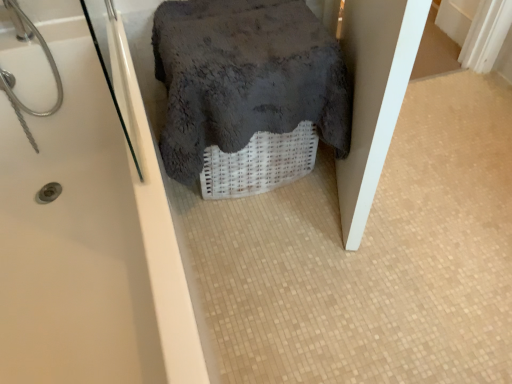
Question: In the image, is dark gray fluffy towel at center on the left side or the right side of white glossy bathtub at upper left?

Choices:
 (A) left
 (B) right

Answer: (B)

Question: Is dark gray fluffy towel at center inside or outside of white glossy bathtub at upper left?

Choices:
 (A) outside
 (B) inside

Answer: (A)

Question: Looking at their shapes, would you say dark gray fluffy towel at center is wider or thinner than white glossy bathtub at upper left?

Choices:
 (A) wide
 (B) thin

Answer: (B)

Question: Is white glossy bathtub at upper left inside the boundaries of dark gray fluffy towel at center, or outside?

Choices:
 (A) outside
 (B) inside

Answer: (A)

Question: From a real-world perspective, is white glossy bathtub at upper left physically located above or below dark gray fluffy towel at center?

Choices:
 (A) below
 (B) above

Answer: (A)

Question: Considering the positions of white glossy bathtub at upper left and dark gray fluffy towel at center in the image, is white glossy bathtub at upper left taller or shorter than dark gray fluffy towel at center?

Choices:
 (A) tall
 (B) short

Answer: (A)

Question: In terms of size, does white glossy bathtub at upper left appear bigger or smaller than dark gray fluffy towel at center?

Choices:
 (A) small
 (B) big

Answer: (B)